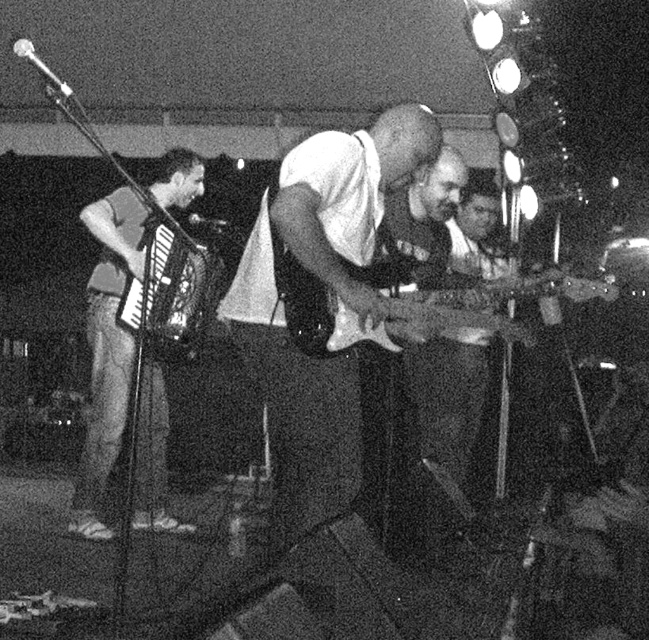
Is white matte guitar at center further to the viewer compared to matte gray accordion at left?

That is False.

Does white matte guitar at center have a lesser height compared to matte gray accordion at left?

Indeed, white matte guitar at center has a lesser height compared to matte gray accordion at left.

Is point (289, 248) more distant than point (80, 499)?

No.

What are the coordinates of `white matte guitar at center` in the screenshot? It's located at (319, 289).

Can you confirm if matte gray accordion at left is smaller than metallic silver guitar at center?

Incorrect, matte gray accordion at left is not smaller in size than metallic silver guitar at center.

Can you confirm if matte gray accordion at left is positioned below metallic silver guitar at center?

Indeed, matte gray accordion at left is positioned under metallic silver guitar at center.

Who is more forward, (82, 452) or (484, 285)?

Point (484, 285)

Identify the location of matte gray accordion at left. (106, 355).

Is white matte guitar at center positioned before metallic accordion at left?

Yes, it is in front of metallic accordion at left.

Which is in front, point (247, 246) or point (169, 237)?

Positioned in front is point (247, 246).

The width and height of the screenshot is (649, 640). I want to click on white matte guitar at center, so click(319, 289).